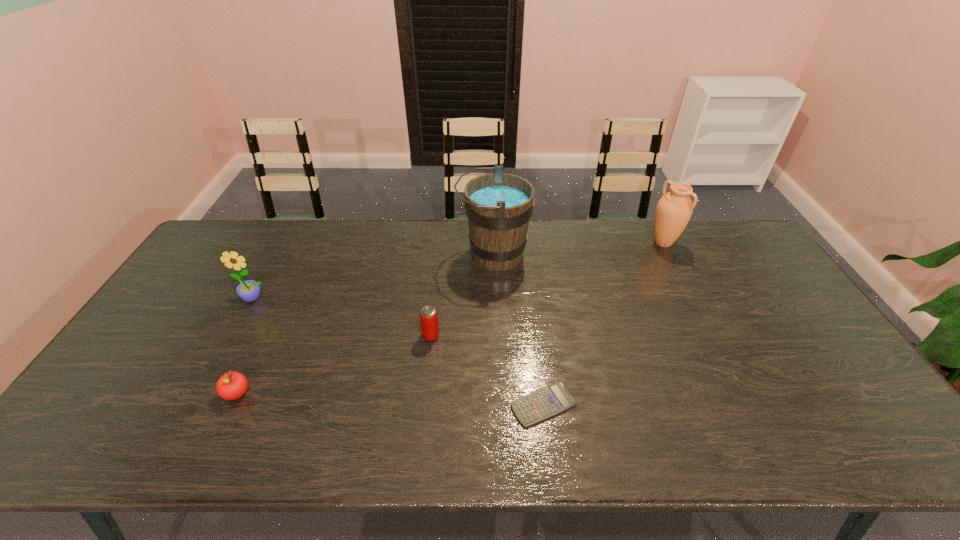
Image resolution: width=960 pixels, height=540 pixels. What are the coordinates of `free space that satisfies the following two spatial constraints: 1. on the back side of the calculator; 2. on the right side of the urn` in the screenshot? It's located at click(x=524, y=243).

This screenshot has width=960, height=540. I want to click on free spot that satisfies the following two spatial constraints: 1. on the back side of the rightmost object; 2. on the left side of the beer can, so click(x=441, y=243).

Image resolution: width=960 pixels, height=540 pixels. I want to click on vacant space that satisfies the following two spatial constraints: 1. on the back side of the apple; 2. on the left side of the beer can, so click(265, 335).

This screenshot has width=960, height=540. I want to click on vacant area in the image that satisfies the following two spatial constraints: 1. with a handle on the side of the wine bucket; 2. on the back side of the shortest object, so click(x=498, y=404).

Locate an element on the screen. Image resolution: width=960 pixels, height=540 pixels. free region that satisfies the following two spatial constraints: 1. with a handle on the side of the wine bucket; 2. on the front-facing side of the sunflower is located at coordinates (x=494, y=298).

The height and width of the screenshot is (540, 960). In order to click on free space that satisfies the following two spatial constraints: 1. on the front side of the calculator; 2. on the right side of the apple in this screenshot , I will do `click(232, 404)`.

This screenshot has height=540, width=960. What are the coordinates of `vacant area that satisfies the following two spatial constraints: 1. on the front side of the shortest object; 2. on the right side of the apple` in the screenshot? It's located at (232, 404).

This screenshot has height=540, width=960. In order to click on free location that satisfies the following two spatial constraints: 1. with a handle on the side of the tallest object; 2. on the front-facing side of the third farthest object in this screenshot , I will do `click(494, 298)`.